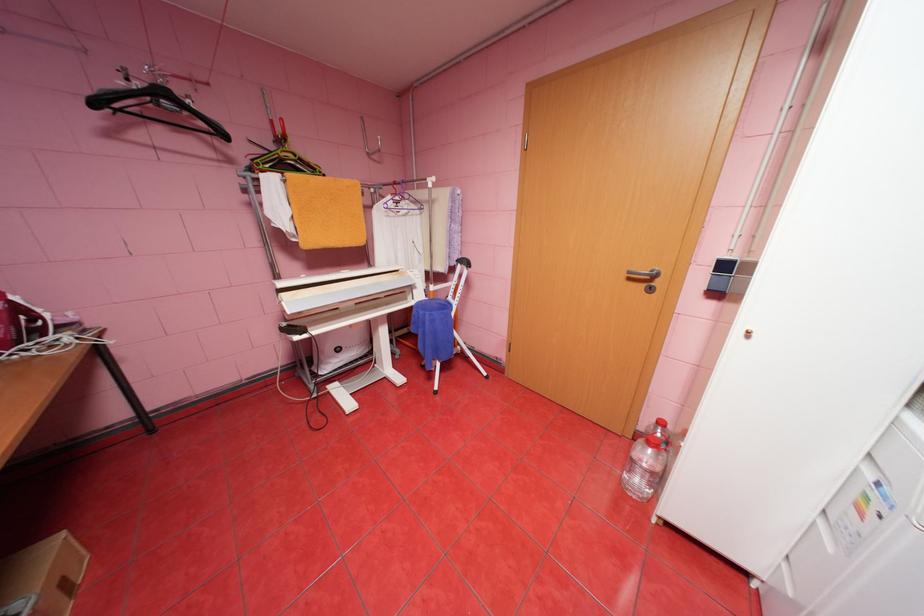
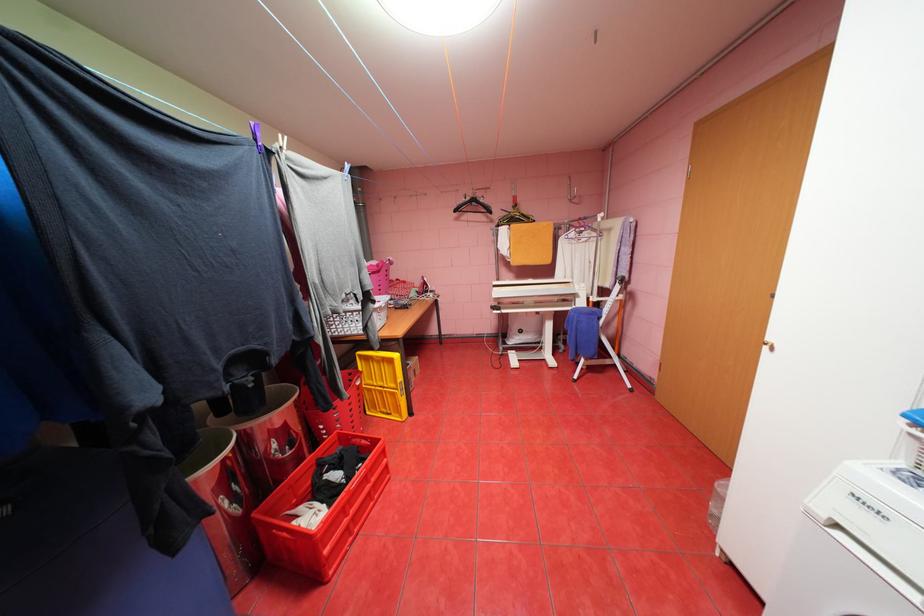
The point at [419,286] is marked in the first image. Where is the corresponding point in the second image?

(584, 294)